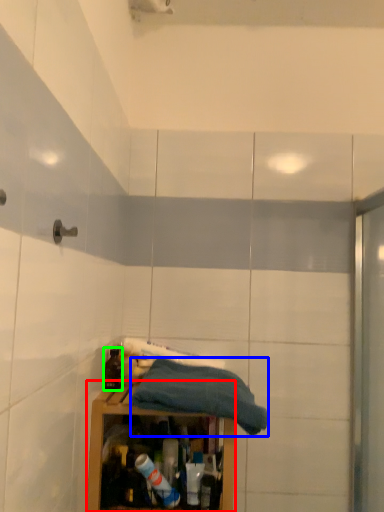
Question: Estimate the real-world distances between objects in this image. Which object is farther from cabinetry (highlighted by a red box), towel (highlighted by a blue box) or bottle (highlighted by a green box)?

Choices:
 (A) towel
 (B) bottle

Answer: (B)